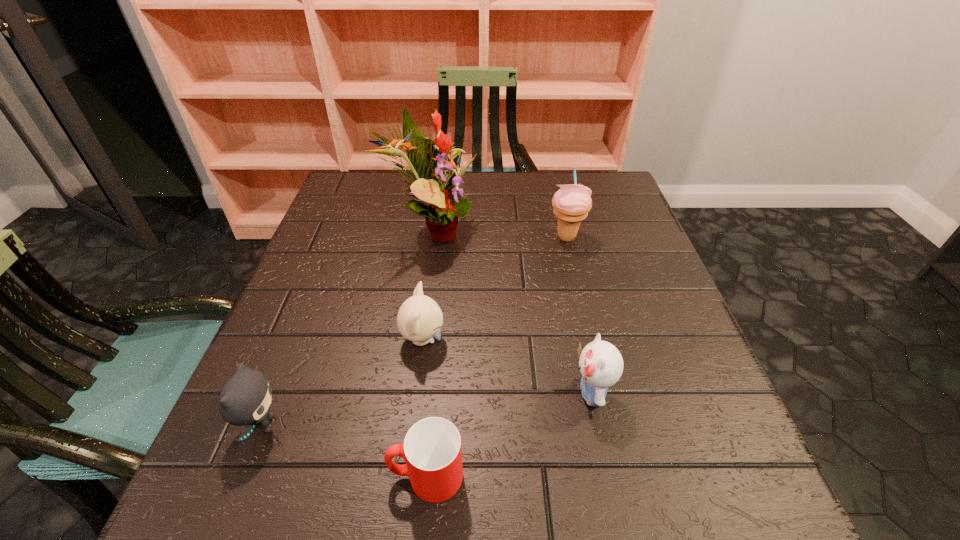
Where is `kitten present at the left edge`? This screenshot has height=540, width=960. kitten present at the left edge is located at coordinates (245, 399).

This screenshot has height=540, width=960. What are the coordinates of `object located in the right edge section of the desktop` in the screenshot? It's located at (571, 203).

The height and width of the screenshot is (540, 960). In order to click on object that is at the far left corner in this screenshot , I will do `click(445, 203)`.

Find the location of a particular element. The width and height of the screenshot is (960, 540). free space at the far edge of the desktop is located at coordinates (474, 171).

The width and height of the screenshot is (960, 540). I want to click on free space at the near edge of the desktop, so click(x=569, y=501).

This screenshot has height=540, width=960. Identify the location of free region at the left edge of the desktop. (275, 382).

In the image, there is a desktop. In order to click on free space at the right edge in this screenshot , I will do tap(588, 242).

The width and height of the screenshot is (960, 540). What are the coordinates of `vacant space at the far left corner` in the screenshot? It's located at (345, 179).

Image resolution: width=960 pixels, height=540 pixels. In the image, there is a desktop. In order to click on free space at the far right corner in this screenshot , I will do `click(602, 186)`.

Locate an element on the screen. This screenshot has height=540, width=960. free space at the near right corner of the desktop is located at coordinates (753, 490).